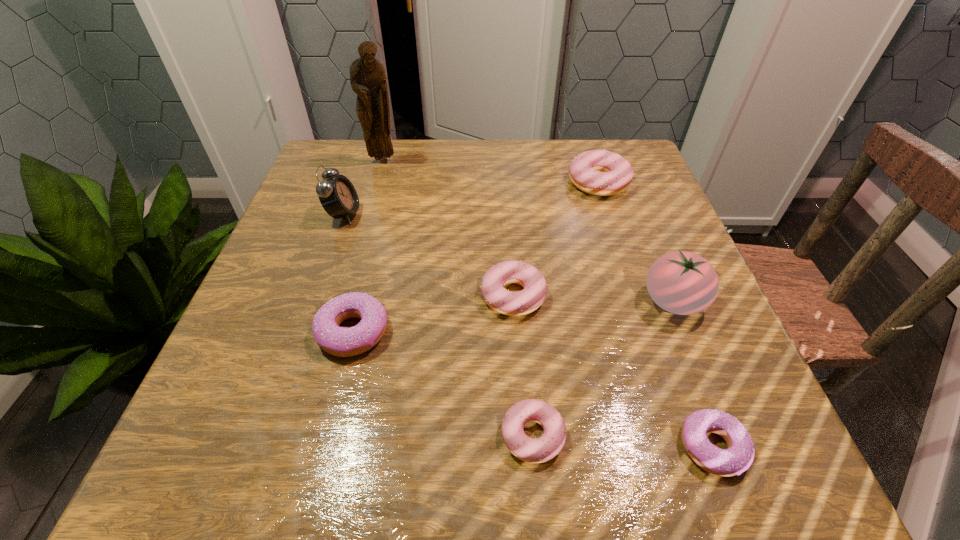
At what (x,y) coordinates should I click in order to perform the action: click on the right purple doughnut. Please return your answer as a coordinate pair (x, y). The image size is (960, 540). Looking at the image, I should click on (739, 456).

Where is `the nearest pink doughnut`? This screenshot has height=540, width=960. the nearest pink doughnut is located at coordinates (534, 450).

You are a GUI agent. You are given a task and a screenshot of the screen. Output one action in this format:
    pyautogui.click(x=<x>, y=<y>)
    Task: Click on the vacant area located 0.210m on the front-facing side of the tallest object
    Image resolution: width=960 pixels, height=540 pixels.
    Given the screenshot: What is the action you would take?
    pyautogui.click(x=367, y=218)

Locate an element on the screen. free space located on the face of the white alarm clock is located at coordinates (396, 214).

At what (x,y) coordinates should I click in order to perform the action: click on free space located on the front of the red tomato. Please return your answer as a coordinate pair (x, y). Looking at the image, I should click on pyautogui.click(x=707, y=384).

Find the location of a particular element. This screenshot has width=960, height=540. free region located on the right of the biggest pink doughnut is located at coordinates (655, 182).

Find the location of a particular element. The width and height of the screenshot is (960, 540). free space located on the back of the farther purple doughnut is located at coordinates (382, 217).

I want to click on free space located on the left of the second smallest pink doughnut, so 386,295.

Locate an element on the screen. vacant space situated 0.360m on the back of the right purple doughnut is located at coordinates (638, 247).

Locate an element on the screen. The height and width of the screenshot is (540, 960). vacant region located on the back of the smallest pink doughnut is located at coordinates point(524,339).